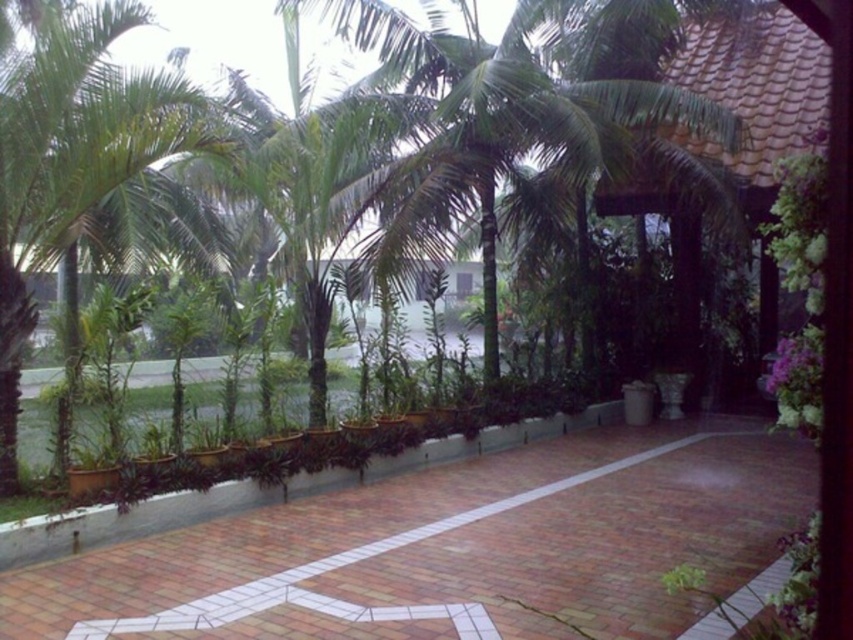
Question: Does brick pavement at center appear on the left side of green leafy palm tree at left?

Choices:
 (A) yes
 (B) no

Answer: (B)

Question: Is brick pavement at center below green leafy palm tree at left?

Choices:
 (A) yes
 (B) no

Answer: (A)

Question: Does brick pavement at center appear on the right side of green leafy palm tree at left?

Choices:
 (A) yes
 (B) no

Answer: (A)